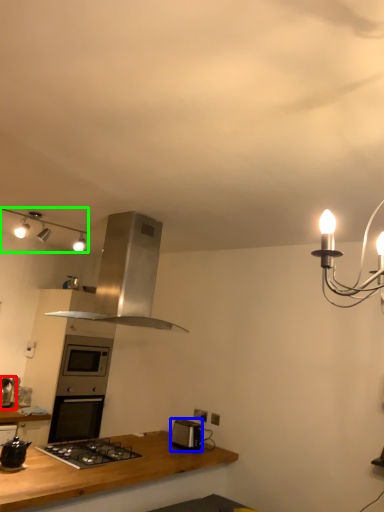
Question: Considering the real-world distances, which object is farthest from appliance (highlighted by a red box)? toaster (highlighted by a blue box) or lamp (highlighted by a green box)?

Choices:
 (A) toaster
 (B) lamp

Answer: (A)